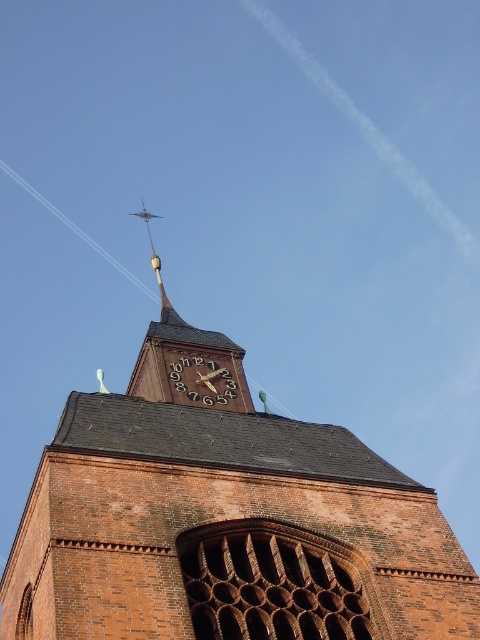
Question: Can you confirm if brown brick church at center is wider than gold/yellow metal spire at upper center?

Choices:
 (A) yes
 (B) no

Answer: (A)

Question: Which of the following is the farthest from the observer?

Choices:
 (A) (136, 211)
 (B) (310, 486)
 (C) (197, 384)

Answer: (A)

Question: Is brown wooden clock at center positioned before gold/yellow metal spire at upper center?

Choices:
 (A) no
 (B) yes

Answer: (B)

Question: Which object appears closest to the camera in this image?

Choices:
 (A) gold/yellow metal spire at upper center
 (B) brown brick church at center
 (C) brown wooden clock at center

Answer: (B)

Question: Among these points, which one is farthest from the camera?

Choices:
 (A) (400, 602)
 (B) (203, 372)

Answer: (B)

Question: Does brown brick church at center appear on the right side of brown wooden clock at center?

Choices:
 (A) yes
 (B) no

Answer: (B)